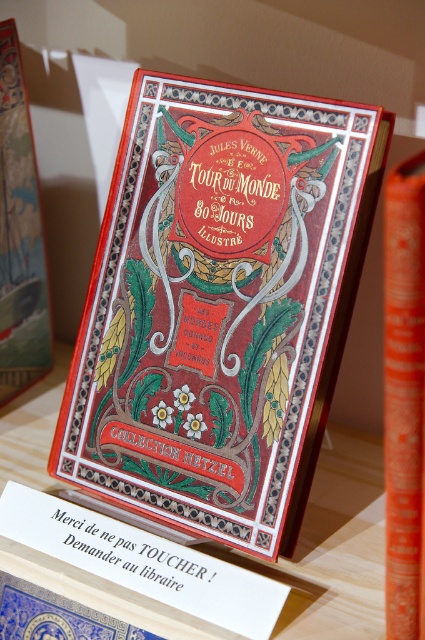
You are a book collector who wants to place a new book on your shelf. The shelf has a width of 28 inches. You have a matte red book at center. Will it fit on the shelf?

The matte red book at center is 27.94 inches in width, so it will fit on the 28 inch shelf since it is slightly narrower.

You have a small decorative item that is 10 cm wide. You want to place it on the matte wood table at center without overlapping the orange matte book at center. Is there enough space on the table for both items side by side?

The matte wood table at center is wider than the orange matte book at center, so there should be enough space to place the 10 cm decorative item next to the book without overlapping.

You are a librarian organizing a display. You have a matte red book at center and a white paper sign at center. Which object is closer to you?

The matte red book at center is closer to you because the white paper sign at center is behind it.